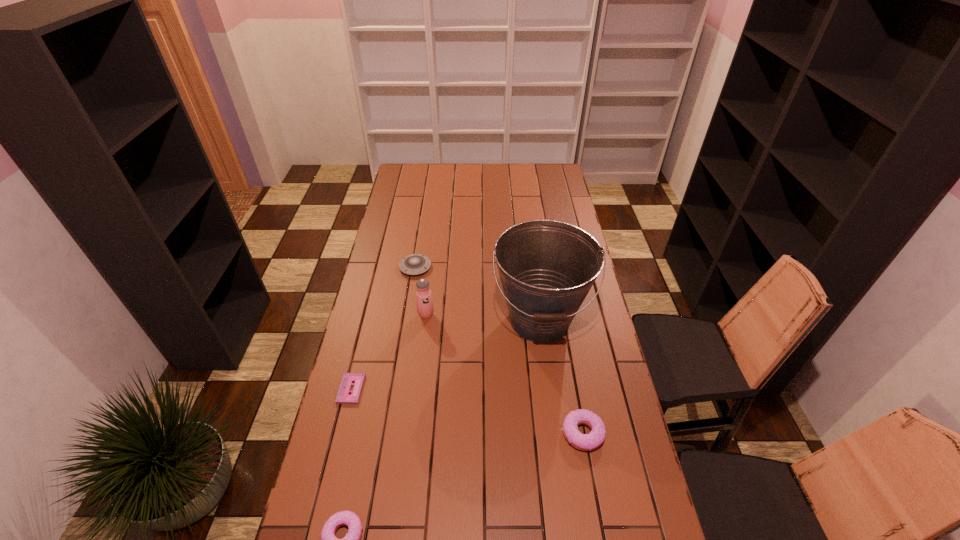
To achieve uniform spacing by inserting another doughnut among them, please point to a free space for this new doughnut. Please provide its 2D coordinates. Your answer should be formatted as a tuple, i.e. [(x, y)], where the tuple contains the x and y coordinates of a point satisfying the conditions above.

[(472, 480)]